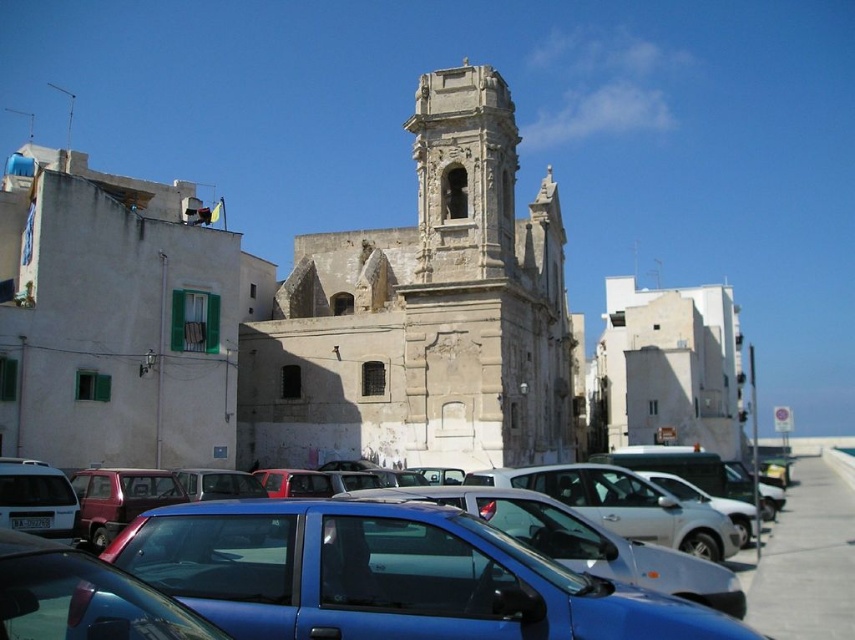
You are a delivery driver who needs to park your metallic blue sedan at center. The parking spot is located at point (x=416, y=572). Can you safely park your car there?

Point (x=416, y=572) marks the metallic blue sedan at center, so yes, you can safely park your metallic blue sedan at center there as it is already marked at that location.

In the scene shown: You are standing at the center of the historic stone building with a bell tower. You notice two points marked on the ground in front of you. The first point is at coordinates point (481, 296) and the second point is at point (621, 381). Which point is closer to you?

Point (481, 296) is closer to you because it is in front of point (621, 381).

You are a photographer positioned at the edge of the street. You want to capture a photo of the white stone church at center without the metallic blue sedan at center blocking the view. Is the church visible above the sedan?

The white stone church at center is above the metallic blue sedan at center, so yes, the church is visible above the sedan in the photo.